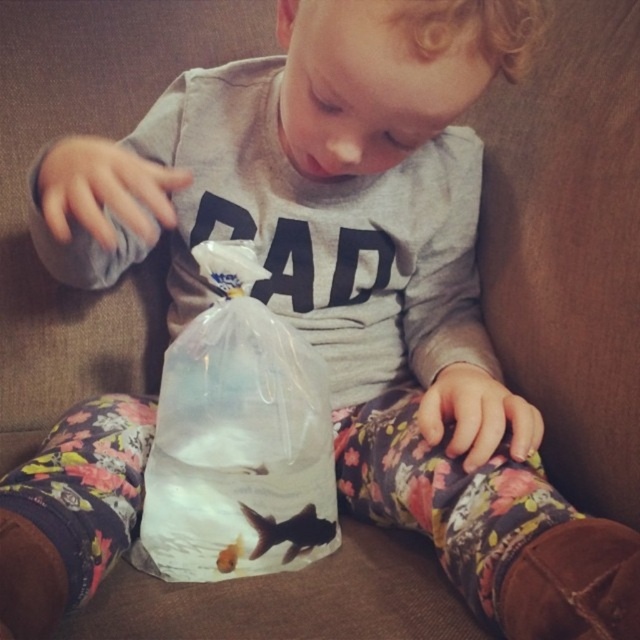
Question: Can you confirm if transparent plastic bag at center is positioned to the left of translucent plastic goldfish at center?

Choices:
 (A) yes
 (B) no

Answer: (B)

Question: Can you confirm if transparent plastic bag at center is positioned to the right of black matte fish at center?

Choices:
 (A) yes
 (B) no

Answer: (B)

Question: Which point appears farthest from the camera in this image?

Choices:
 (A) (236, 550)
 (B) (284, 556)

Answer: (B)

Question: Considering the relative positions of black matte fish at center and translucent plastic goldfish at center in the image provided, where is black matte fish at center located with respect to translucent plastic goldfish at center?

Choices:
 (A) left
 (B) right

Answer: (B)

Question: Which object is positioned closest to the transparent plastic bag at center?

Choices:
 (A) translucent plastic goldfish at center
 (B) black matte fish at center

Answer: (B)

Question: Among these points, which one is nearest to the camera?

Choices:
 (A) (205, 506)
 (B) (241, 538)
 (C) (257, 547)

Answer: (A)